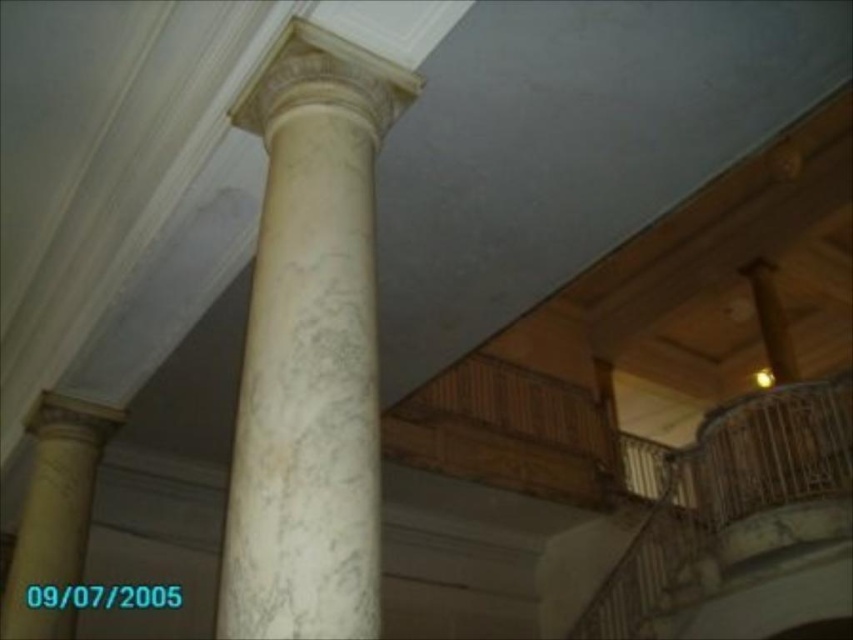
You are standing at point A, which is at coordinates (310,348). What object is located at your current position?

The white marble column at center is located at point A, which is at coordinates (310,348).

You are an architect examining the interior of a historical building. You notice two columns, the white marble column at center and the white marble column at left. Based on their positions, which one do you think is wider?

The white marble column at center might be wider than white marble column at left according to the description.